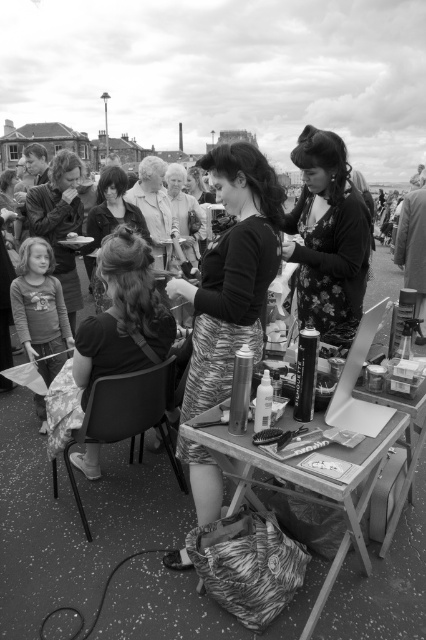
Is matte white jacket at center thinner than matte gray sweater at center?

In fact, matte white jacket at center might be wider than matte gray sweater at center.

Which is below, matte white jacket at center or matte gray sweater at center?

matte gray sweater at center

Between point (163, 260) and point (172, 205), which one is positioned in front?

Point (163, 260)

Where is `matte white jacket at center`? The height and width of the screenshot is (640, 426). matte white jacket at center is located at coordinates [155, 211].

Does metallic silver table at center have a smaller size compared to matte black shirt at center?

Indeed, metallic silver table at center has a smaller size compared to matte black shirt at center.

Does metallic silver table at center have a lesser height compared to matte black shirt at center?

Yes.

Does point (356, 509) lie in front of point (104, 333)?

Yes.

The width and height of the screenshot is (426, 640). I want to click on metallic silver table at center, so click(305, 483).

Who is shorter, floral fabric dress at center or matte black jacket at center?

With less height is floral fabric dress at center.

Is floral fabric dress at center wider than matte black jacket at center?

No, floral fabric dress at center is not wider than matte black jacket at center.

Describe the element at coordinates (328, 237) in the screenshot. I see `floral fabric dress at center` at that location.

Find the location of `floral fabric dress at center`. floral fabric dress at center is located at coordinates (328, 237).